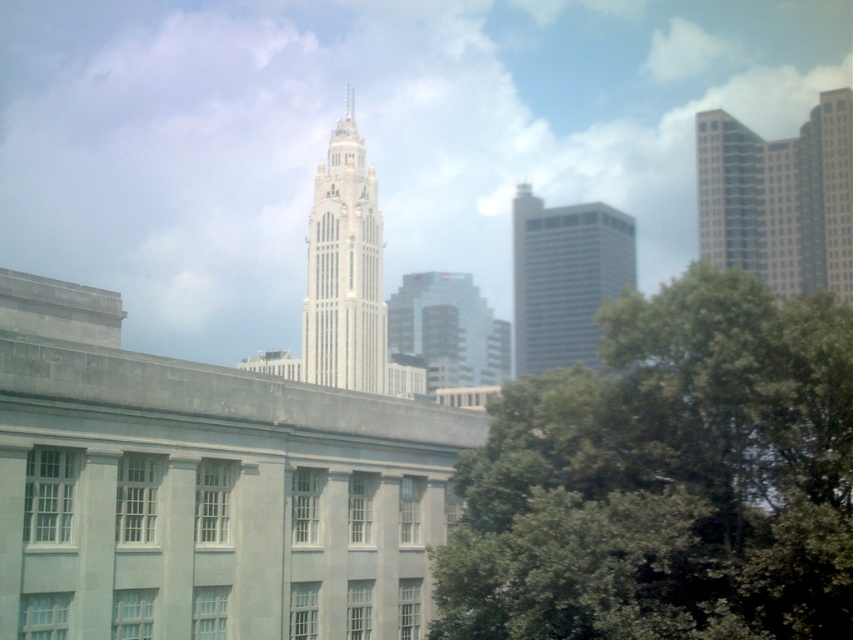
You are standing in the city and want to take a photo of the white glass tower at center and the glassy reflective skyscraper at center. Which one is to the left of the other?

The white glass tower at center is positioned on the left side of the glassy reflective skyscraper at center.

You are standing in the city and see the point marked at coordinates (666, 480). What object is this point located on?

The point marked at coordinates (666, 480) is located on the green leafy tree at center.

You are a city planner evaluating the placement of a new green space. You see the green leafy tree at center and the glassy reflective skyscraper at center. Which object is located beneath the other?

The green leafy tree at center is positioned under the glassy reflective skyscraper at center.